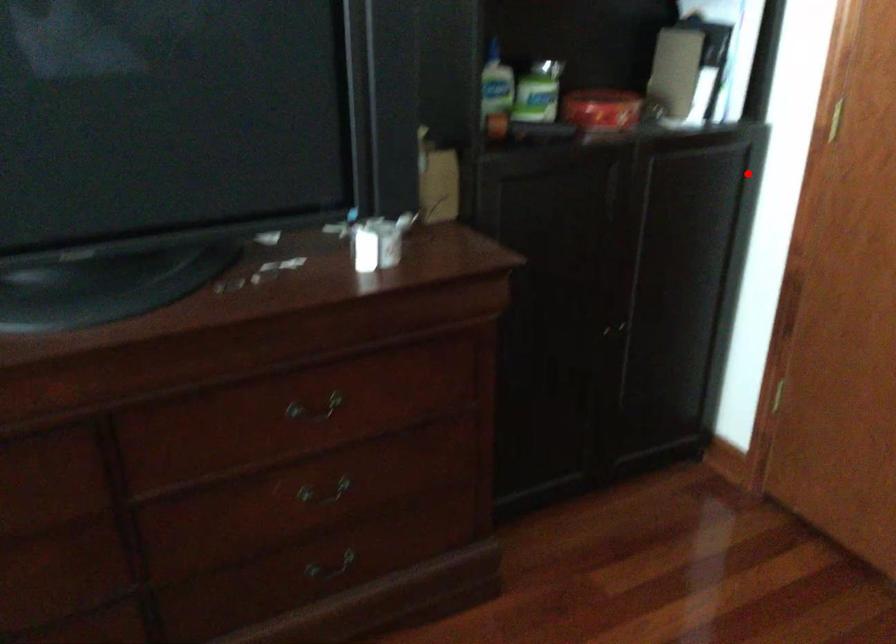
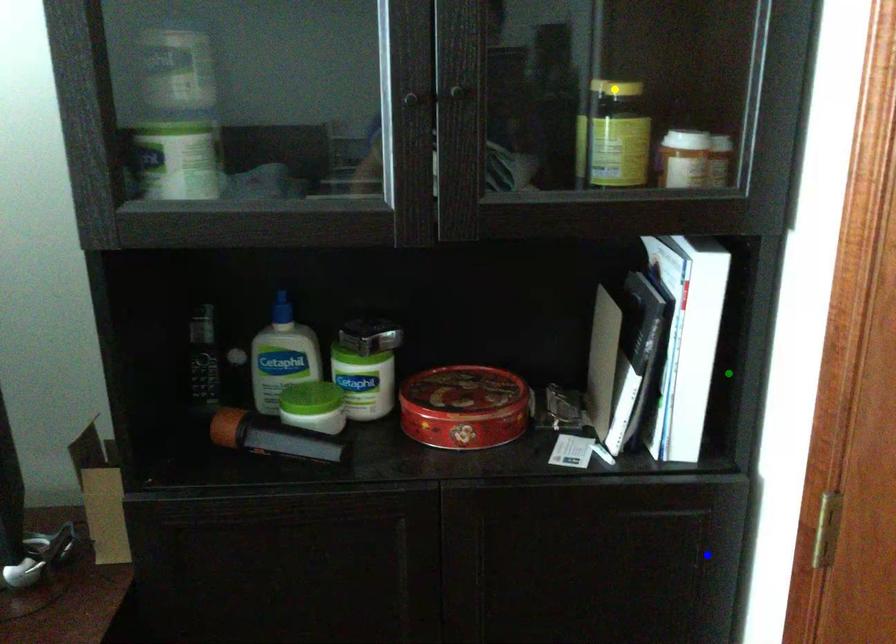
Question: I am providing you with two images of the same scene from different viewpoints. A red point is marked on the first image. You are given multiple points on the second image. Which point in image 2 represents the same 3d spot as the red point in image 1?

Choices:
 (A) green point
 (B) yellow point
 (C) blue point

Answer: (C)